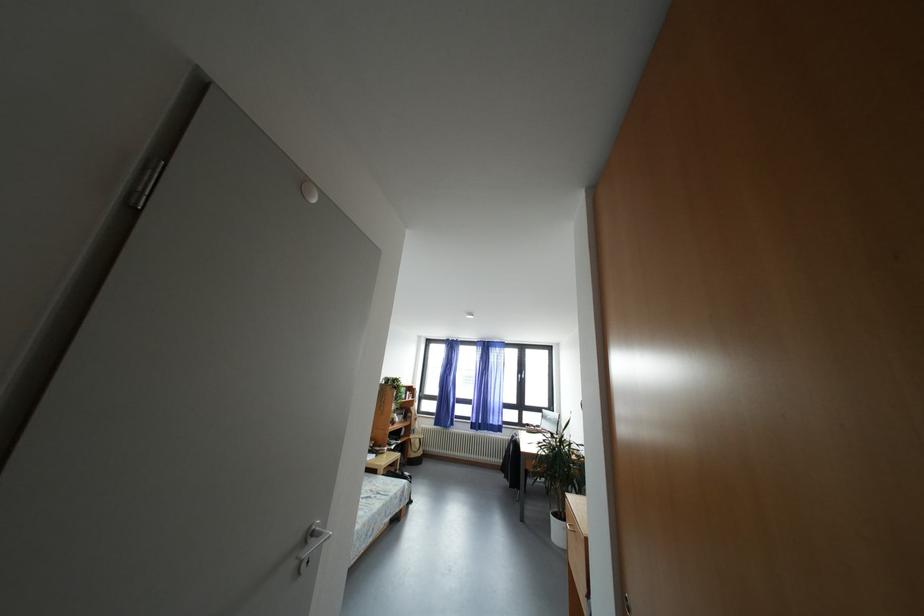
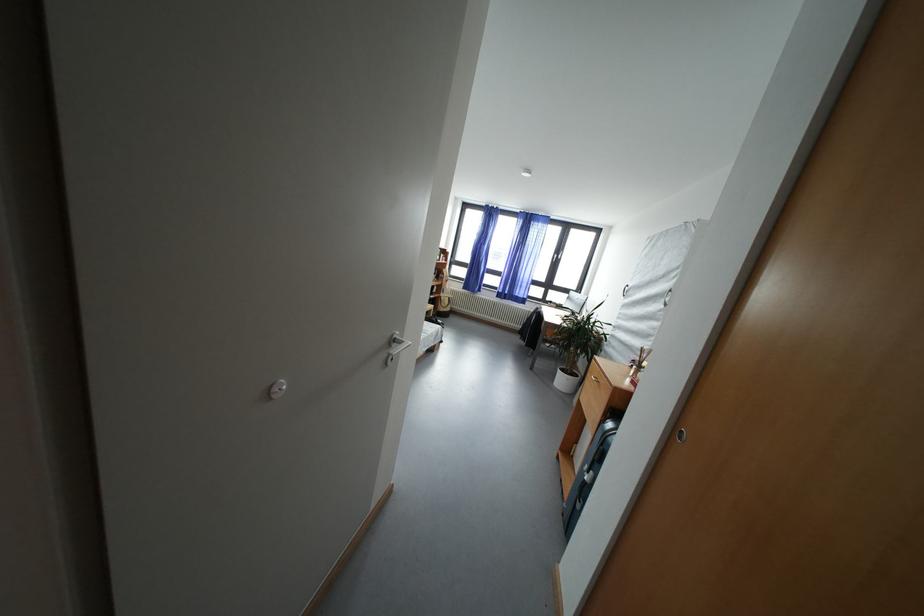
The images are taken continuously from a first-person perspective. In which direction are you moving?

The cameraman walked toward left, forward.